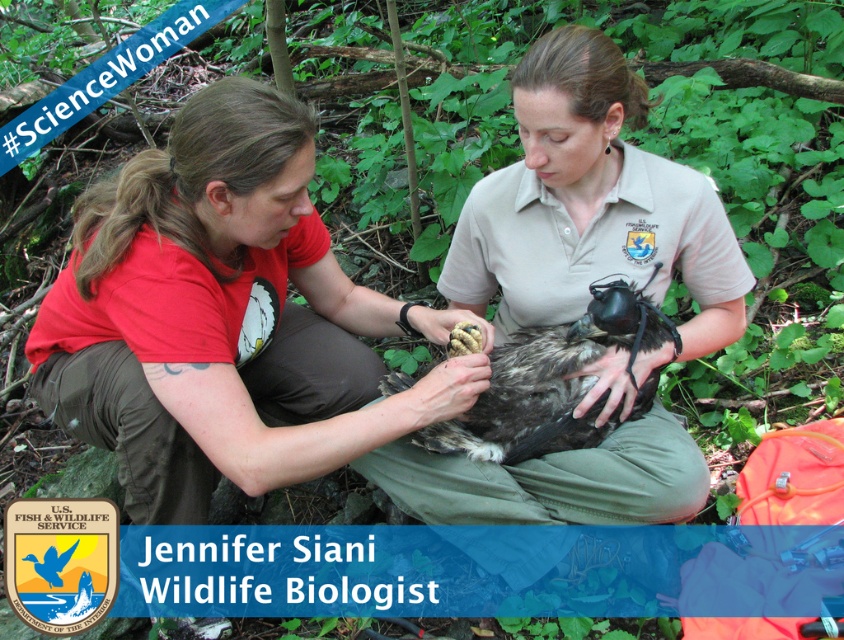
You are a nature photographer aiming to capture a clear photo of the matte khaki shirt at center and the dark brown feathered eagle at center. Since the eagle is a subject of interest, how should you adjust your camera focus to ensure both are in focus?

The matte khaki shirt at center is much taller than the dark brown feathered eagle at center, so you should focus on the matte khaki shirt at center to ensure both are in focus.

You are a wildlife photographer aiming to capture a closeup shot of the bird being handled by the person in the matte red shirt at center. Given that your camera lens has a focal length of 300mm, which allows focusing on subjects within a 1.5 meter radius, can you determine if the bird is within range?

The matte red shirt at center is located at point (x=225, y=317) in the image. Since the camera lens has a 1.5 meter radius, the bird being handled by the matte red shirt at center is within range for a closeup shot.

You are a hiker who has spotted two people in the forest. One is wearing a matte khaki shirt at center and the other is interacting with a dark brown feathered eagle at center. From your position, which one is higher up?

The matte khaki shirt at center is above the dark brown feathered eagle at center, so the person wearing the matte khaki shirt at center is higher up.